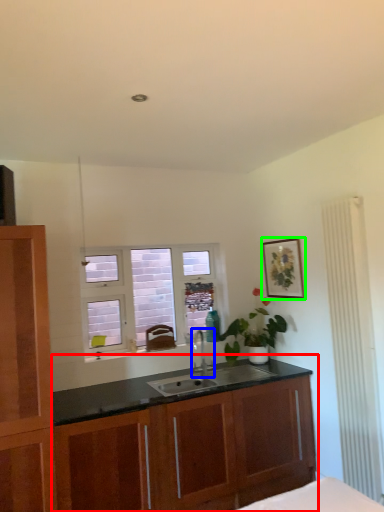
Question: Which object is positioned farthest from cabinetry (highlighted by a red box)? Select from tap (highlighted by a blue box) and picture frame (highlighted by a green box).

Choices:
 (A) tap
 (B) picture frame

Answer: (B)